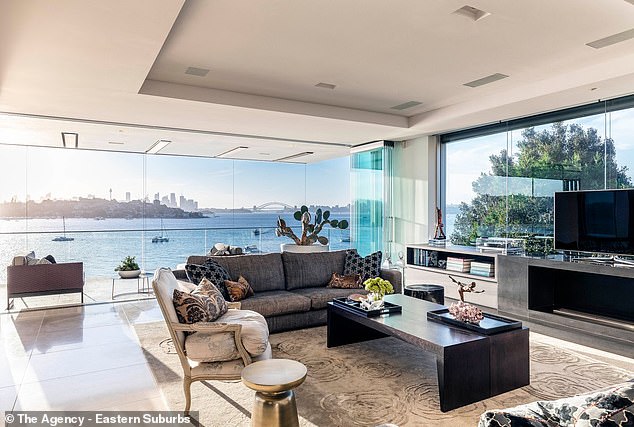
Identify the location of books in shelf. (458, 264).